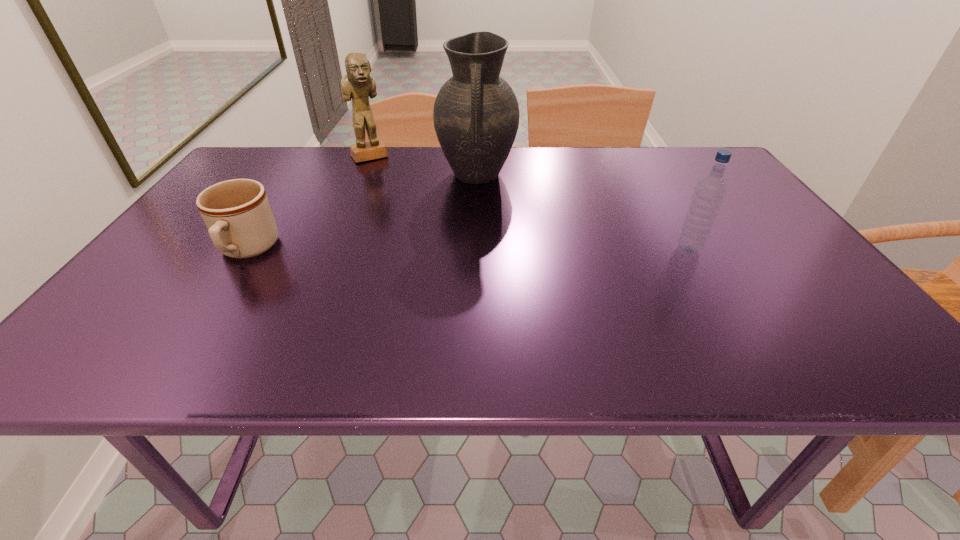
The height and width of the screenshot is (540, 960). What are the coordinates of `free space on the desktop that is between the mug and the rightmost object and is positioned on the side of the third object from left to right with the handle` in the screenshot? It's located at (475, 250).

At what (x,y) coordinates should I click in order to perform the action: click on free space on the desktop that is between the mug and the rightmost object and is positioned on the front-facing side of the figurine. Please return your answer as a coordinate pair (x, y). This screenshot has width=960, height=540. Looking at the image, I should click on (444, 250).